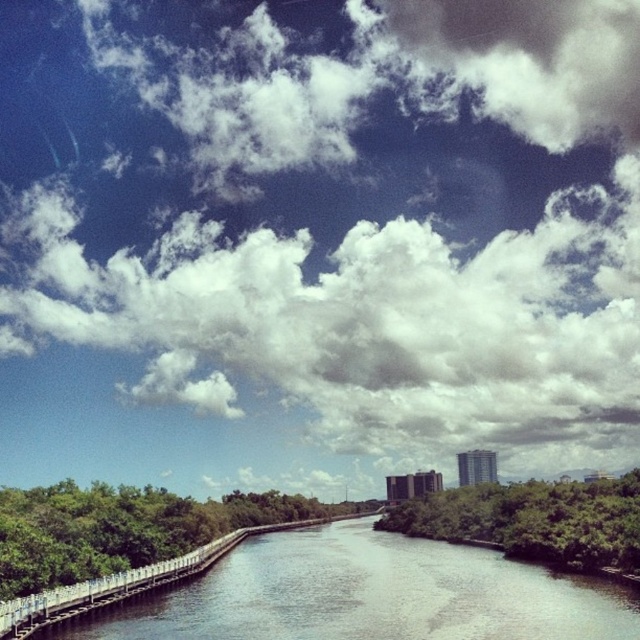
You are a photographer standing at the riverside and want to capture a photo of the white fluffy cloud at upper center. If your camera has a focal length of 50mm, will you need to zoom in or out to frame the cloud properly?

The white fluffy cloud at upper center is 514.77 meters away from the camera. Since the cloud is quite far away, you will need to zoom in to frame it properly.

You are standing at the riverside and looking up at the sky. There is a point marked at coordinates (369,227). What object is located at that point?

The point at coordinates (369,227) corresponds to a white fluffy cloud at upper center.